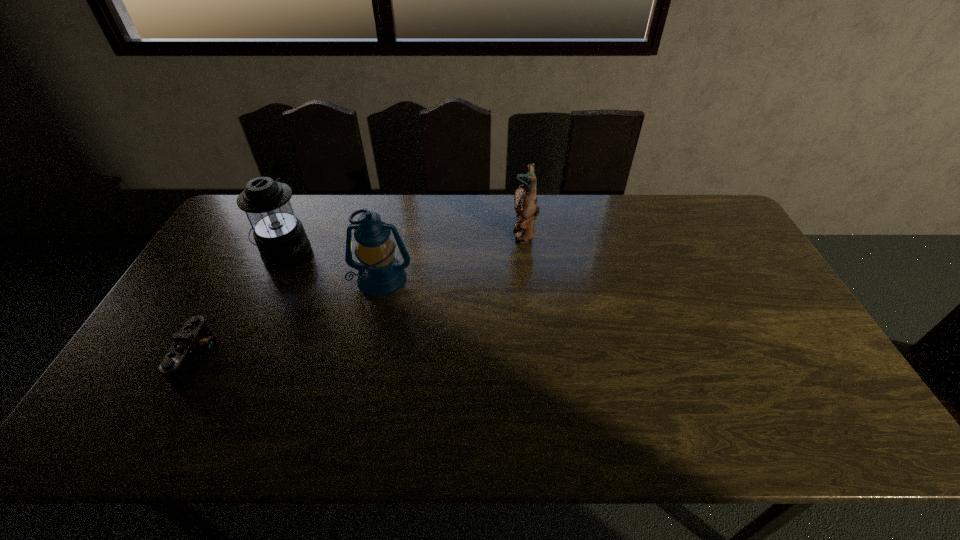
Where is `free point between the figurine and the left lantern`? free point between the figurine and the left lantern is located at coordinates (404, 244).

I want to click on free area in between the rightmost object and the left lantern, so click(x=404, y=244).

This screenshot has height=540, width=960. I want to click on free spot between the camera and the figurine, so click(362, 297).

I want to click on free space between the figurine and the nearest object, so click(x=362, y=297).

In order to click on vacant area between the right lantern and the figurine in this screenshot , I will do `click(453, 256)`.

Locate an element on the screen. This screenshot has height=540, width=960. free space between the left lantern and the camera is located at coordinates (243, 307).

This screenshot has height=540, width=960. What are the coordinates of `vacant space that's between the left lantern and the nearest object` in the screenshot? It's located at pos(243,307).

I want to click on the closest object to the figurine, so 380,273.

Locate an element on the screen. The image size is (960, 540). object that stands as the closest to the nearest object is located at coordinates (279, 235).

Where is `vacant space that satisfies the following two spatial constraints: 1. on the front-facing side of the rightmost object; 2. on the face of the right lantern`? Image resolution: width=960 pixels, height=540 pixels. vacant space that satisfies the following two spatial constraints: 1. on the front-facing side of the rightmost object; 2. on the face of the right lantern is located at coordinates (528, 279).